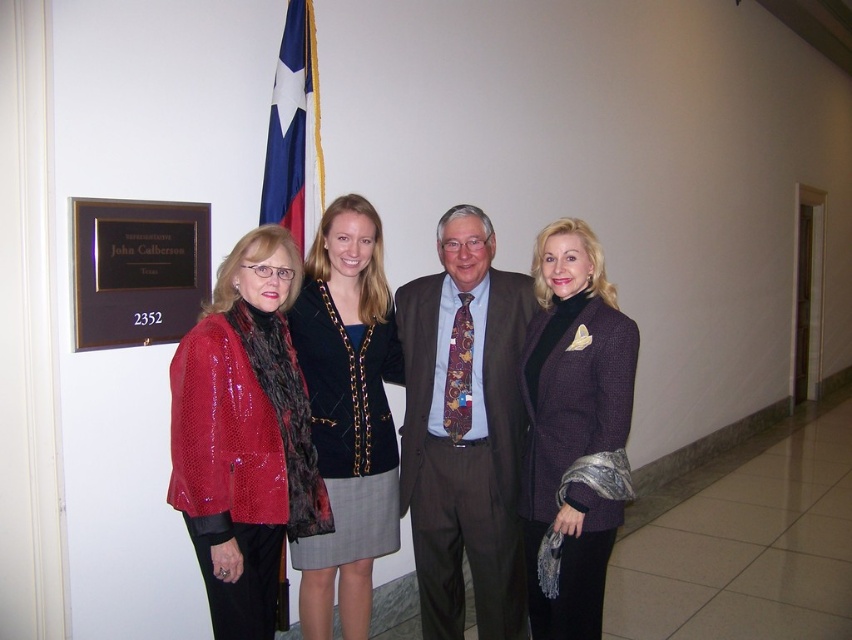
Question: Is brown textured suit at center thinner than shiny red sequined jacket at left?

Choices:
 (A) yes
 (B) no

Answer: (B)

Question: Is black polished wood sign at upper left wider than blue fabric flag at upper center?

Choices:
 (A) yes
 (B) no

Answer: (A)

Question: Does shiny red sequined jacket at left appear over black polished wood sign at upper left?

Choices:
 (A) no
 (B) yes

Answer: (A)

Question: Which is nearer to the brown textured suit at center?

Choices:
 (A) blue fabric flag at upper center
 (B) purple textured blazer at right
 (C) black polished wood sign at upper left
 (D) shiny red sequined jacket at left

Answer: (B)

Question: Which point is closer to the camera taking this photo?

Choices:
 (A) (501, 460)
 (B) (376, 428)

Answer: (B)

Question: Which is nearer to the black polished wood sign at upper left?

Choices:
 (A) blue fabric flag at upper center
 (B) shiny red sequined jacket at left
 (C) brown textured suit at center
 (D) purple textured blazer at right

Answer: (B)